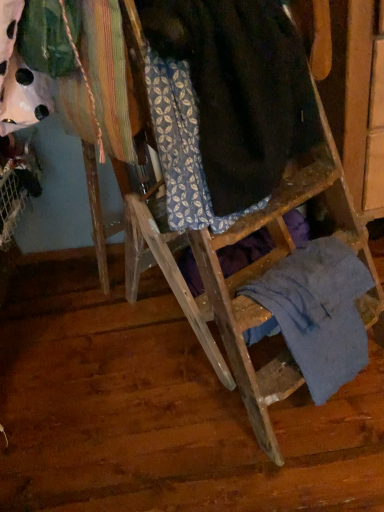
Question: Considering the positions of blue cotton shirt at lower right and dark brown wool at center in the image, is blue cotton shirt at lower right wider or thinner than dark brown wool at center?

Choices:
 (A) thin
 (B) wide

Answer: (A)

Question: From their relative heights in the image, would you say blue cotton shirt at lower right is taller or shorter than dark brown wool at center?

Choices:
 (A) tall
 (B) short

Answer: (B)

Question: Is blue cotton shirt at lower right in front of or behind dark brown wool at center in the image?

Choices:
 (A) front
 (B) behind

Answer: (B)

Question: In the image, is dark brown wool at center on the left side or the right side of blue cotton shirt at lower right?

Choices:
 (A) left
 (B) right

Answer: (A)

Question: In terms of height, does dark brown wool at center look taller or shorter compared to blue cotton shirt at lower right?

Choices:
 (A) tall
 (B) short

Answer: (A)

Question: Is dark brown wool at center inside the boundaries of blue cotton shirt at lower right, or outside?

Choices:
 (A) inside
 (B) outside

Answer: (B)

Question: Is point (249, 199) closer or farther from the camera than point (297, 315)?

Choices:
 (A) farther
 (B) closer

Answer: (B)